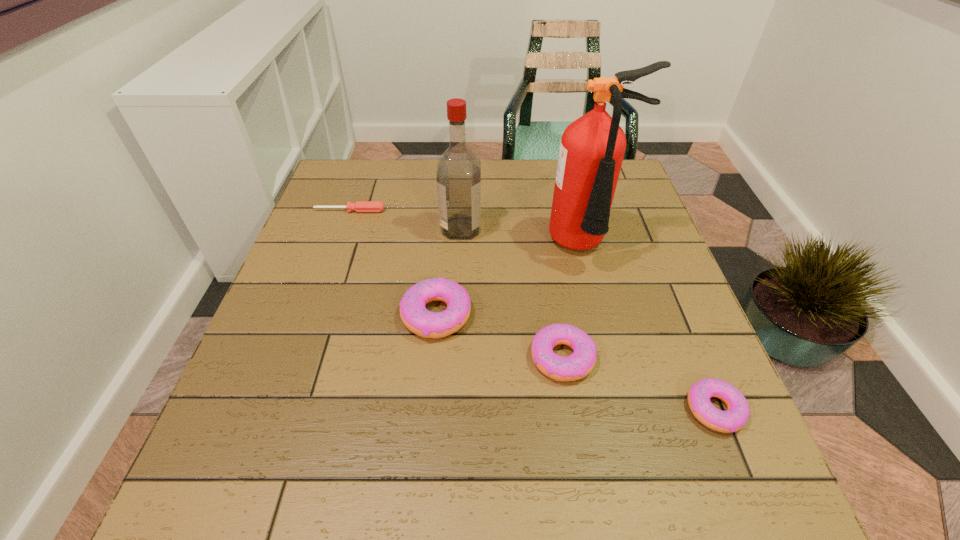
At what (x,y) coordinates should I click in order to perform the action: click on free space located 0.280m on the back of the leftmost doughnut. Please return your answer as a coordinate pair (x, y). This screenshot has height=540, width=960. Looking at the image, I should click on (445, 214).

You are a GUI agent. You are given a task and a screenshot of the screen. Output one action in this format:
    pyautogui.click(x=<x>, y=<y>)
    Task: Click on the free space located 0.100m on the back of the second doughnut from right to left
    This screenshot has height=540, width=960.
    Given the screenshot: What is the action you would take?
    pyautogui.click(x=553, y=297)

This screenshot has width=960, height=540. What are the coordinates of `vacant space situated on the back of the fifth tallest object` in the screenshot? It's located at (653, 258).

This screenshot has width=960, height=540. What are the coordinates of `free space located at the nozzle of the fire extinguisher` in the screenshot? It's located at (627, 404).

The height and width of the screenshot is (540, 960). I want to click on vacant position located 0.190m on the front-facing side of the second tallest object, so click(x=553, y=228).

Identify the location of vacant space situated 0.320m on the front of the farthest object. (319, 301).

Locate an element on the screen. Image resolution: width=960 pixels, height=540 pixels. object positioned at the near edge is located at coordinates (737, 414).

You are a GUI agent. You are given a task and a screenshot of the screen. Output one action in this format:
    pyautogui.click(x=<x>, y=<y>)
    Task: Click on the object at the left edge
    The width and height of the screenshot is (960, 540).
    Given the screenshot: What is the action you would take?
    pyautogui.click(x=360, y=206)

The image size is (960, 540). In order to click on doughnut that is at the right edge in this screenshot , I will do `click(737, 414)`.

The height and width of the screenshot is (540, 960). What are the coordinates of `fire extinguisher that is at the right edge` in the screenshot? It's located at (592, 148).